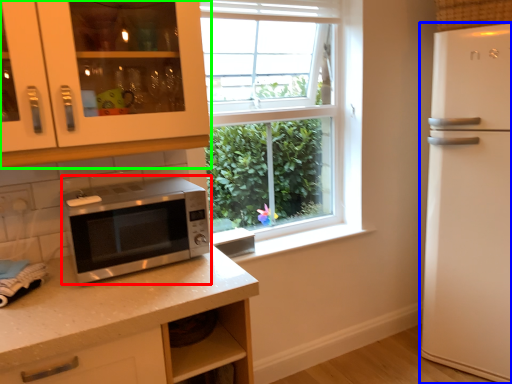
Question: Based on their relative distances, which object is farther from microwave oven (highlighted by a red box)? Choose from refrigerator (highlighted by a blue box) and cabinetry (highlighted by a green box).

Choices:
 (A) refrigerator
 (B) cabinetry

Answer: (A)